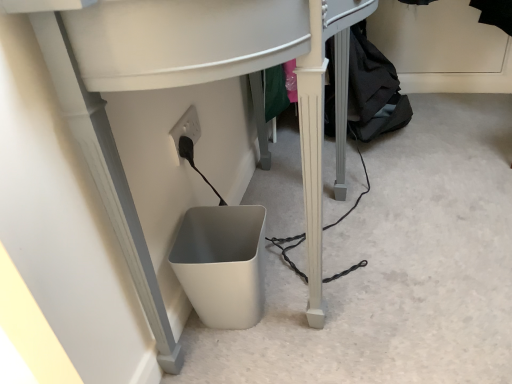
Question: From a real-world perspective, does white matte waste container at lower center sit lower than black fabric at lower right?

Choices:
 (A) no
 (B) yes

Answer: (B)

Question: Considering the relative sizes of white matte waste container at lower center and black fabric at lower right in the image provided, is white matte waste container at lower center taller than black fabric at lower right?

Choices:
 (A) yes
 (B) no

Answer: (B)

Question: Is white matte waste container at lower center shorter than black fabric at lower right?

Choices:
 (A) yes
 (B) no

Answer: (A)

Question: Is white matte waste container at lower center thinner than black fabric at lower right?

Choices:
 (A) yes
 (B) no

Answer: (A)

Question: Is white matte waste container at lower center not inside black fabric at lower right?

Choices:
 (A) no
 (B) yes

Answer: (B)

Question: Considering their positions, is white matte waste container at lower center located in front of or behind black fabric at lower right?

Choices:
 (A) behind
 (B) front

Answer: (B)

Question: Does point pos(227,319) appear closer or farther from the camera than point pos(370,89)?

Choices:
 (A) closer
 (B) farther

Answer: (A)

Question: Would you say white matte waste container at lower center is inside or outside black fabric at lower right?

Choices:
 (A) inside
 (B) outside

Answer: (B)

Question: In terms of height, does white matte waste container at lower center look taller or shorter compared to black fabric at lower right?

Choices:
 (A) tall
 (B) short

Answer: (B)

Question: Considering the positions of white matte waste container at lower center and white plastic computer desk at lower center in the image, is white matte waste container at lower center wider or thinner than white plastic computer desk at lower center?

Choices:
 (A) wide
 (B) thin

Answer: (B)

Question: From a real-world perspective, is white matte waste container at lower center above or below white plastic computer desk at lower center?

Choices:
 (A) above
 (B) below

Answer: (B)

Question: Based on their positions, is white matte waste container at lower center located to the left or right of white plastic computer desk at lower center?

Choices:
 (A) right
 (B) left

Answer: (B)

Question: Considering the positions of point (258, 251) and point (352, 14), is point (258, 251) closer or farther from the camera than point (352, 14)?

Choices:
 (A) farther
 (B) closer

Answer: (A)

Question: Looking at their shapes, would you say white plastic computer desk at lower center is wider or thinner than white matte waste container at lower center?

Choices:
 (A) thin
 (B) wide

Answer: (B)

Question: Is white plastic computer desk at lower center in front of or behind white matte waste container at lower center in the image?

Choices:
 (A) front
 (B) behind

Answer: (A)